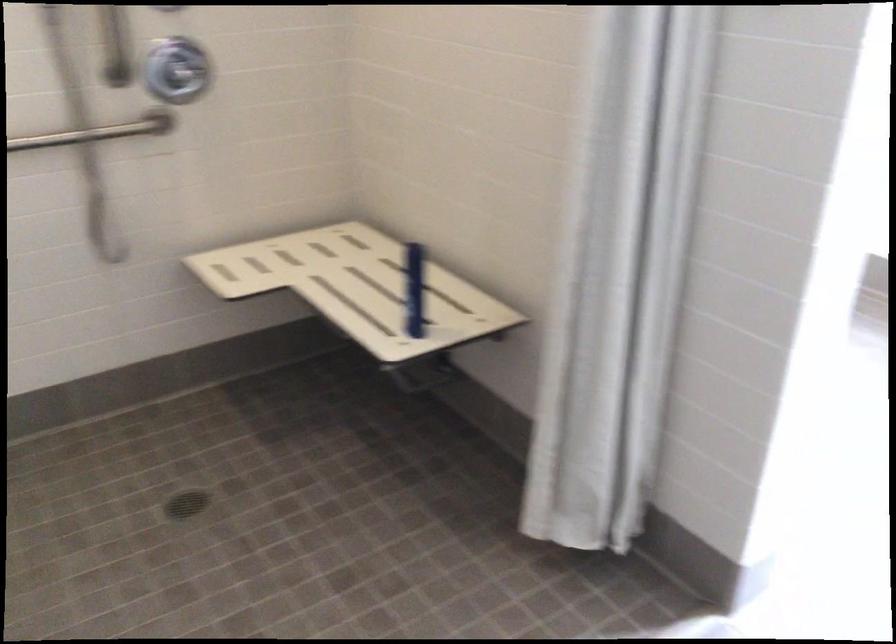
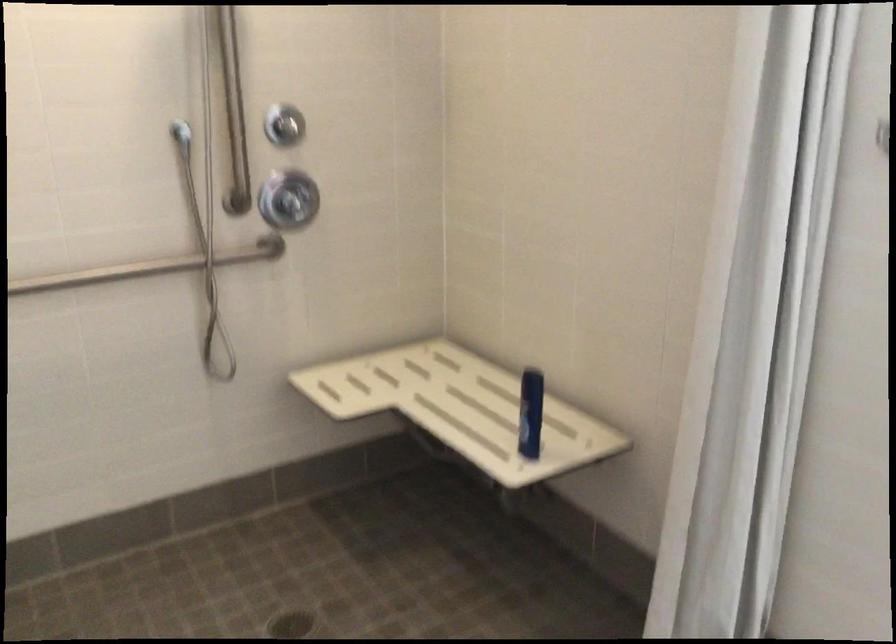
In the second image, find the point that corresponds to (x=410, y=289) in the first image.

(530, 413)